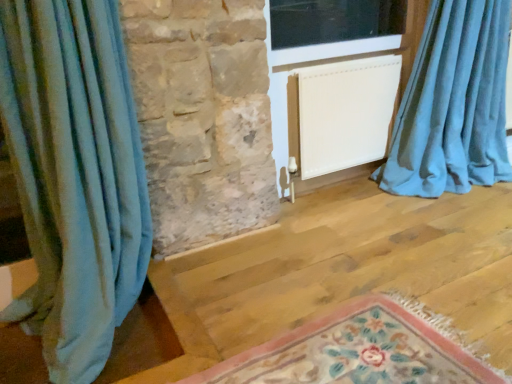
Question: From the image's perspective, relative to white matte radiator at center, is transparent glass window at upper center above or below?

Choices:
 (A) below
 (B) above

Answer: (B)

Question: Looking at the image, does transparent glass window at upper center seem bigger or smaller compared to white matte radiator at center?

Choices:
 (A) big
 (B) small

Answer: (B)

Question: Based on their relative distances, which object is farther from the blue velvet curtain at right, which ranks as the 1th curtain in right-to-left order?

Choices:
 (A) blue fabric curtain at left, which is counted as the second curtain, starting from the right
 (B) white matte radiator at center
 (C) white matte screen door at center
 (D) floral rug at lower center
 (E) transparent glass window at upper center

Answer: (A)

Question: Based on their relative distances, which object is farther from the transparent glass window at upper center?

Choices:
 (A) white matte screen door at center
 (B) blue velvet curtain at right, which ranks as the 1th curtain in right-to-left order
 (C) blue fabric curtain at left, which ranks as the 1th curtain in left-to-right order
 (D) white matte radiator at center
 (E) floral rug at lower center

Answer: (E)